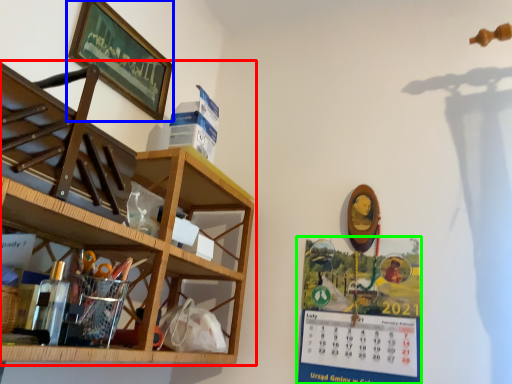
Question: Which object is the closest to the shelf (highlighted by a red box)? Choose among these: picture frame (highlighted by a blue box) or poster (highlighted by a green box).

Choices:
 (A) picture frame
 (B) poster

Answer: (A)